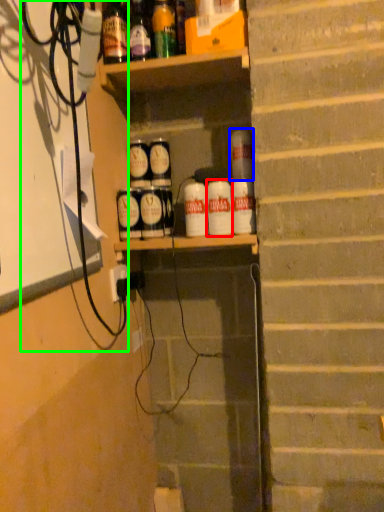
Question: Based on their relative distances, which object is farther from beverage (highlighted by a red box)? Choose from beverage (highlighted by a blue box) and cable (highlighted by a green box).

Choices:
 (A) beverage
 (B) cable

Answer: (B)